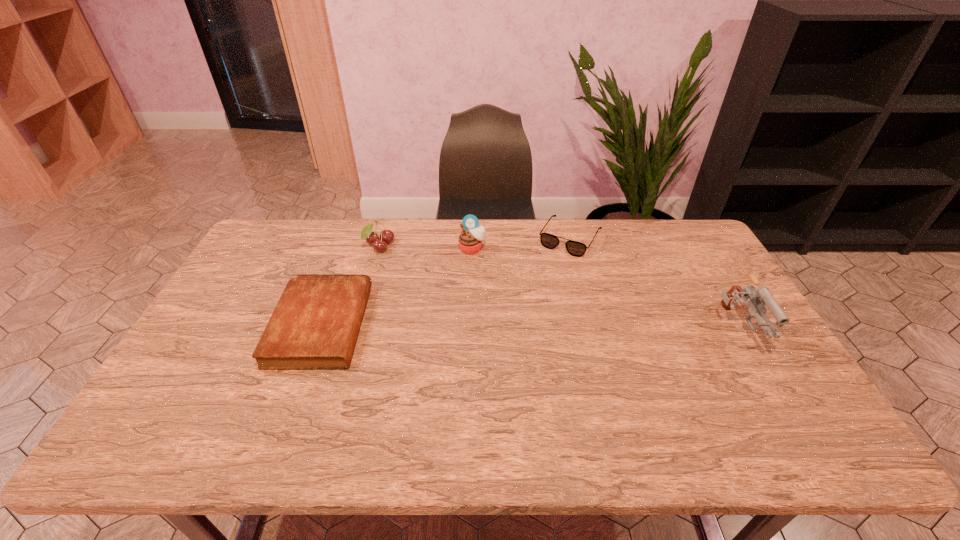
At what (x,y) coordinates should I click in order to perform the action: click on Bible. Please return your answer as a coordinate pair (x, y). The height and width of the screenshot is (540, 960). Looking at the image, I should click on (315, 324).

Where is `the tallest object`? The image size is (960, 540). the tallest object is located at coordinates (761, 296).

Identify the location of gun. The height and width of the screenshot is (540, 960). (761, 296).

Where is `the third object from left to right`? the third object from left to right is located at coordinates (470, 240).

Where is `the second tallest object`? This screenshot has width=960, height=540. the second tallest object is located at coordinates point(470,240).

Image resolution: width=960 pixels, height=540 pixels. I want to click on the second object from right to left, so click(574, 248).

Image resolution: width=960 pixels, height=540 pixels. Identify the location of cherry. (386, 236).

The image size is (960, 540). In order to click on vacant space located 0.090m on the spine side of the Bible in this screenshot , I will do `click(395, 325)`.

Locate an element on the screen. This screenshot has width=960, height=540. free space located 0.080m at the barrel end of the rightmost object is located at coordinates (767, 387).

Identify the location of free space located on the front-facing side of the third object from right to left. The image size is (960, 540). (466, 336).